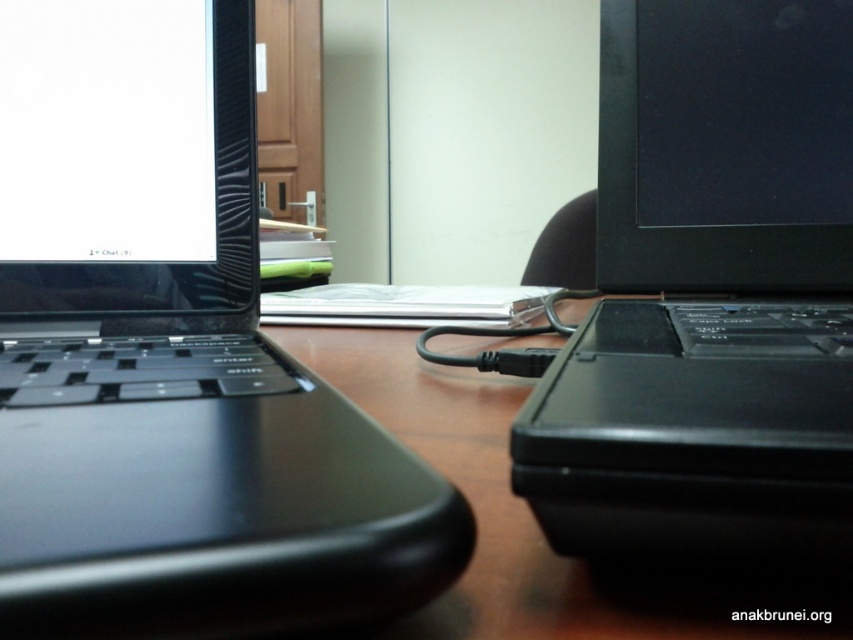
Question: Can you confirm if black matte laptop at left is bigger than black plastic table at center?

Choices:
 (A) yes
 (B) no

Answer: (A)

Question: Is black matte laptop at right to the left of black plastic table at center from the viewer's perspective?

Choices:
 (A) yes
 (B) no

Answer: (B)

Question: Which of the following is the closest to the observer?

Choices:
 (A) (550, 612)
 (B) (71, 275)

Answer: (A)

Question: Which object appears closest to the camera in this image?

Choices:
 (A) black matte laptop at right
 (B) black plastic table at center

Answer: (A)

Question: Does black matte laptop at right appear under black plastic table at center?

Choices:
 (A) yes
 (B) no

Answer: (B)

Question: Which point appears closest to the camera in this image?

Choices:
 (A) (531, 525)
 (B) (207, 45)
 (C) (788, 449)

Answer: (C)